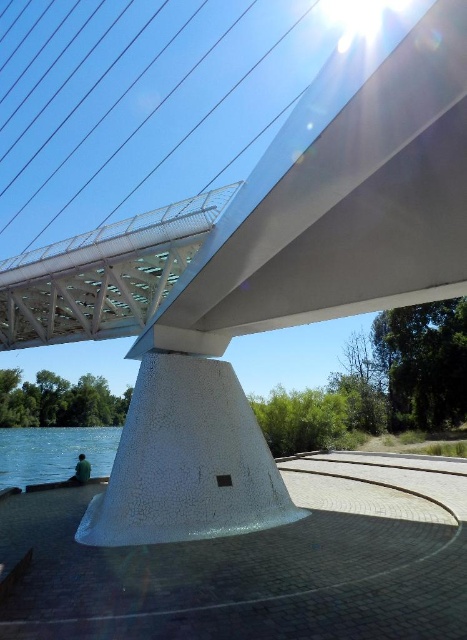
Question: Does blue water at lower left lie in front of dark green fabric at lower left?

Choices:
 (A) yes
 (B) no

Answer: (B)

Question: Can you confirm if blue water at lower left is wider than dark green fabric at lower left?

Choices:
 (A) no
 (B) yes

Answer: (B)

Question: Among these points, which one is nearest to the camera?

Choices:
 (A) (89, 472)
 (B) (64, 451)

Answer: (A)

Question: Among these points, which one is nearest to the camera?

Choices:
 (A) (85, 467)
 (B) (46, 428)

Answer: (A)

Question: In this image, where is blue water at lower left located relative to dark green fabric at lower left?

Choices:
 (A) right
 (B) left

Answer: (B)